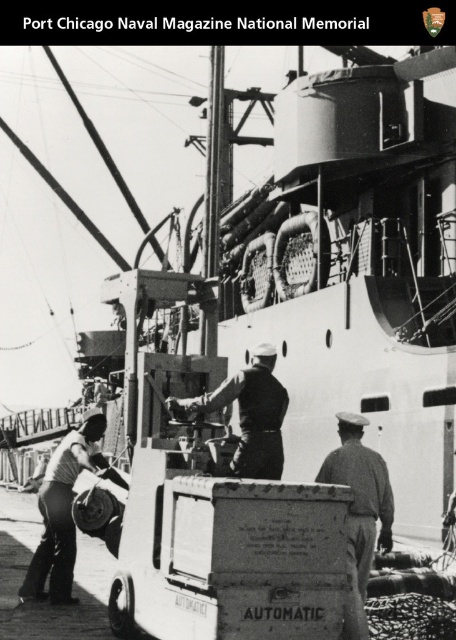
Question: Which point is closer to the camera?

Choices:
 (A) light brown uniform at center
 (B) dark gray uniform at center

Answer: (A)

Question: Can you confirm if light brown uniform at center is bigger than dark gray uniform at center?

Choices:
 (A) no
 (B) yes

Answer: (B)

Question: Does light gray uniform at lower left appear over dark gray uniform at center?

Choices:
 (A) no
 (B) yes

Answer: (A)

Question: Which object is positioned farthest from the dark gray uniform at center?

Choices:
 (A) light gray uniform at lower left
 (B) light brown uniform at center

Answer: (A)

Question: Is light brown uniform at center wider than dark gray uniform at center?

Choices:
 (A) yes
 (B) no

Answer: (B)

Question: Which object is closer to the camera taking this photo?

Choices:
 (A) light brown uniform at center
 (B) dark gray uniform at center

Answer: (A)